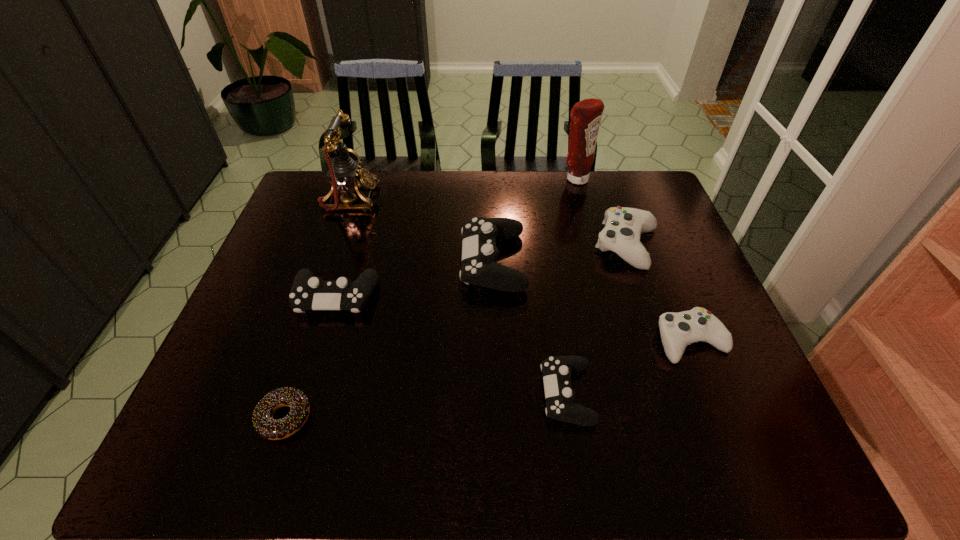
You are a GUI agent. You are given a task and a screenshot of the screen. Output one action in this format:
    pyautogui.click(x=<x>, y=<y>)
    Task: Click on the vacant point located 0.350m on the surface of the nearest black control
    The image size is (960, 540).
    Given the screenshot: What is the action you would take?
    pyautogui.click(x=381, y=394)

Where is `vacant space located on the surface of the nearest black control`? The height and width of the screenshot is (540, 960). vacant space located on the surface of the nearest black control is located at coordinates (510, 394).

Locate an element on the screen. This screenshot has height=540, width=960. vacant space positioned 0.110m on the surface of the nearest black control is located at coordinates (492, 394).

The height and width of the screenshot is (540, 960). In order to click on free space located on the front of the doughnut in this screenshot , I will do `click(268, 469)`.

Locate an element on the screen. This screenshot has height=540, width=960. condiment situated at the far edge is located at coordinates (585, 115).

Where is `telephone present at the far edge`? telephone present at the far edge is located at coordinates (345, 175).

This screenshot has height=540, width=960. Identify the location of control located in the near edge section of the desktop. (557, 370).

Image resolution: width=960 pixels, height=540 pixels. In order to click on doughnut located in the near edge section of the desktop in this screenshot , I will do `click(264, 424)`.

You are a GUI agent. You are given a task and a screenshot of the screen. Output one action in this format:
    pyautogui.click(x=<x>, y=<y>)
    Task: Click on the telephone at the left edge
    The width and height of the screenshot is (960, 540).
    Given the screenshot: What is the action you would take?
    pyautogui.click(x=345, y=175)

Find the location of a particular element. control that is at the left edge is located at coordinates (307, 293).